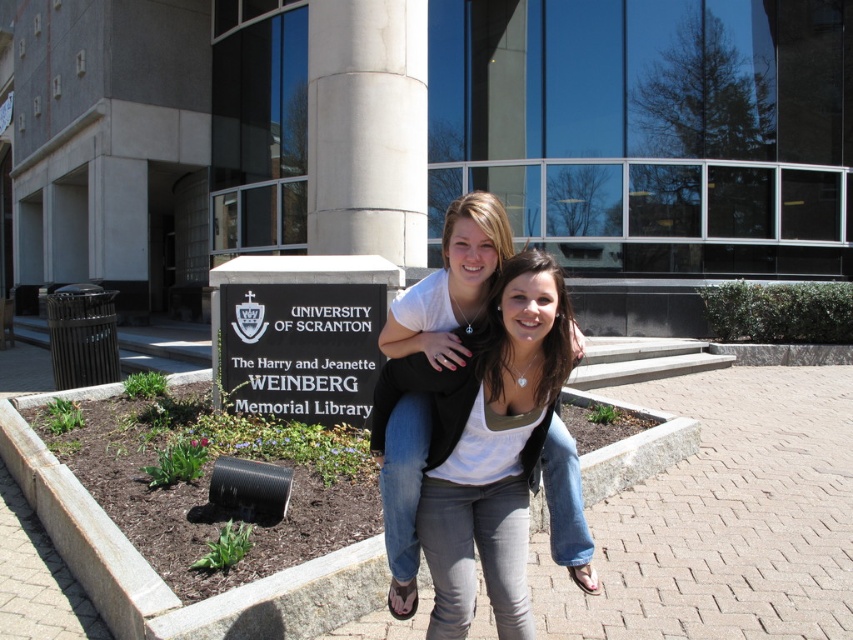
In the scene shown: You are a photographer standing at the edge of the paved area where the two people are posing. You want to take a photo that includes both the white matte shirt at center and the white concrete pillar at center. Given that your camera has a maximum focus range of 20 feet, will you be able to capture both objects in focus without moving your position?

The white matte shirt at center and white concrete pillar at center are 19.90 feet apart. Since the distance between them is within the camera maximum focus range of 20 feet, you can capture both objects in focus without moving your position.